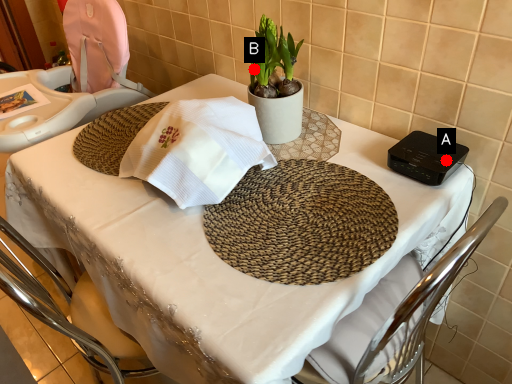
Question: Two points are circled on the image, labeled by A and B beside each circle. Which point appears farthest from the camera in this image?

Choices:
 (A) A is further
 (B) B is further

Answer: (B)